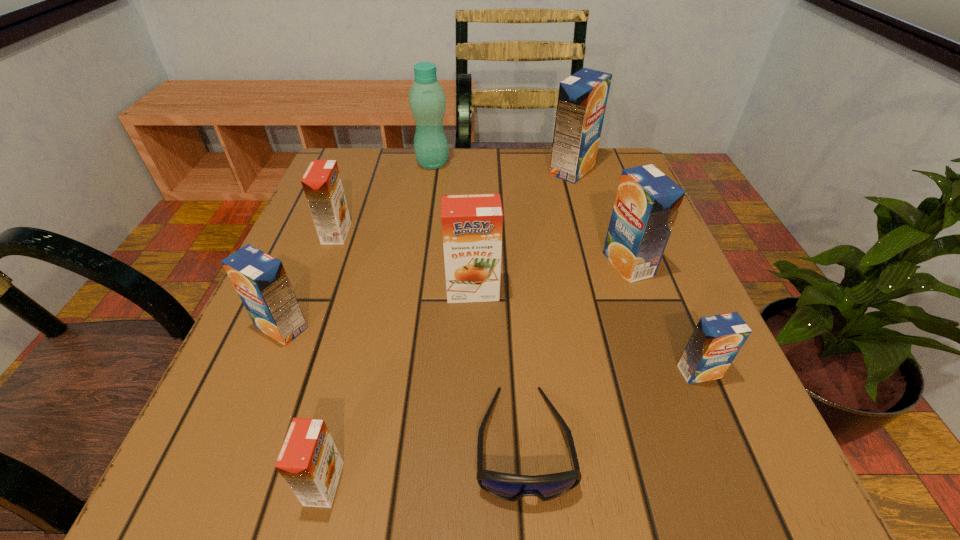
The height and width of the screenshot is (540, 960). What are the coordinates of `vacant space that's between the second smallest blue orange_juice and the third farthest object` in the screenshot? It's located at (309, 280).

This screenshot has height=540, width=960. In order to click on free space between the sixth object from right to left and the sunglasses in this screenshot , I will do `click(478, 303)`.

Where is `free spot between the nearest orange orange juice and the third smallest blue orange_juice`? free spot between the nearest orange orange juice and the third smallest blue orange_juice is located at coordinates (476, 374).

At what (x,y) coordinates should I click in order to perform the action: click on free space between the nearest blue orange_juice and the bottle. Please return your answer as a coordinate pair (x, y). This screenshot has width=960, height=540. Looking at the image, I should click on (565, 267).

At what (x,y) coordinates should I click in order to perform the action: click on object that stands as the sixth closest to the third smallest blue orange_juice. Please return your answer as a coordinate pair (x, y). This screenshot has width=960, height=540. Looking at the image, I should click on (322, 185).

Locate an element on the screen. the eighth closest object to the second biggest blue orange_juice is located at coordinates (260, 280).

Locate an element on the screen. The image size is (960, 540). orange juice that is the sixth closest to the fourth object from left to right is located at coordinates (716, 340).

You are a GUI agent. You are given a task and a screenshot of the screen. Output one action in this format:
    pyautogui.click(x=<x>, y=<y>)
    Task: Click on the orange juice that is the second closest to the seventh nearest object
    
    Given the screenshot: What is the action you would take?
    pyautogui.click(x=472, y=224)

Find the location of a particular element. blue orange_juice that is the closest to the nearest blue orange_juice is located at coordinates tap(647, 202).

Find the location of `the second closest blue orange_juice relative to the smallest blue orange_juice`. the second closest blue orange_juice relative to the smallest blue orange_juice is located at coordinates (582, 99).